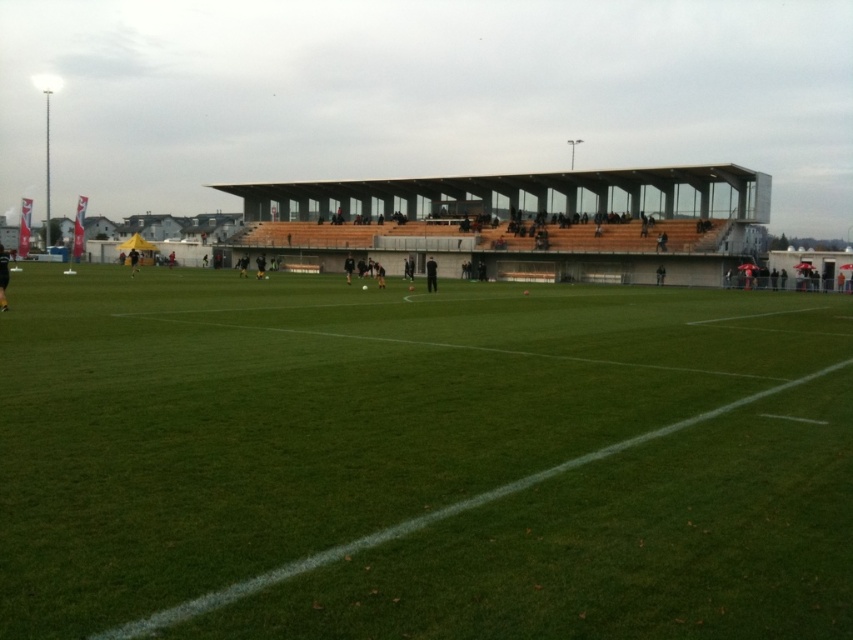
Can you confirm if green grass field at center is wider than transparent glass stadium at upper center?

No.

Is green grass field at center shorter than transparent glass stadium at upper center?

Yes, green grass field at center is shorter than transparent glass stadium at upper center.

Describe the element at coordinates (422, 458) in the screenshot. I see `green grass field at center` at that location.

Image resolution: width=853 pixels, height=640 pixels. Find the location of `green grass field at center`. green grass field at center is located at coordinates (422, 458).